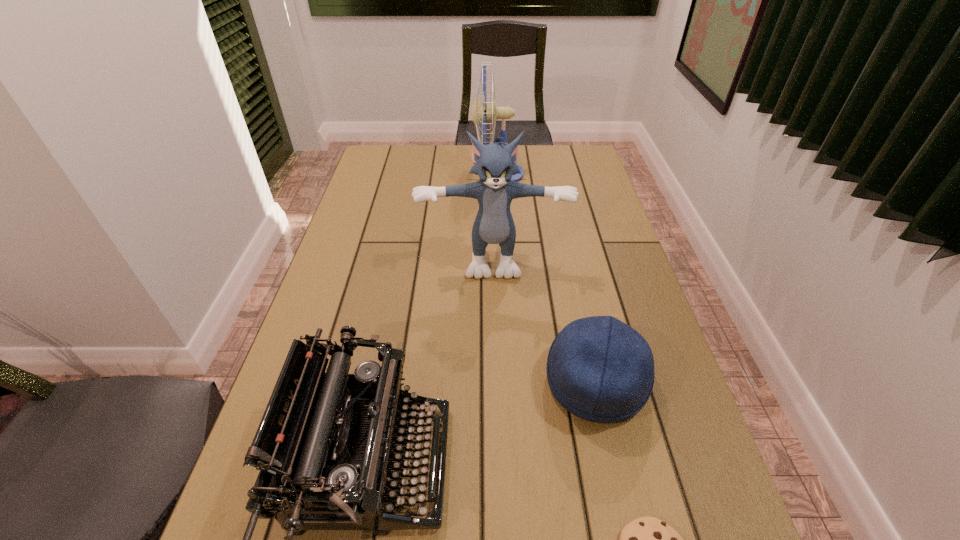
The width and height of the screenshot is (960, 540). Identify the location of blank space at the far edge of the desktop. (445, 154).

Locate an element on the screen. The image size is (960, 540). free point at the left edge is located at coordinates (397, 182).

In the image, there is a desktop. Identify the location of vacant space at the right edge. This screenshot has width=960, height=540. (588, 251).

This screenshot has height=540, width=960. I want to click on free space at the far left corner, so click(x=371, y=172).

This screenshot has height=540, width=960. I want to click on vacant space at the far right corner of the desktop, so click(x=586, y=172).

Point out which object is positioned as the second nearest to the second shortest object. Please provide its 2D coordinates. Your answer should be formatted as a tuple, i.e. [(x, y)], where the tuple contains the x and y coordinates of a point satisfying the conditions above.

[(313, 417)]

Find the location of a particular element. the fourth closest object relative to the third tallest object is located at coordinates (492, 112).

Locate an element on the screen. This screenshot has width=960, height=540. vacant space that satisfies the following two spatial constraints: 1. at the front of the farthest object where the blades are visible; 2. on the front-facing side of the second farthest object is located at coordinates (503, 256).

Identify the location of free spot that satisfies the following two spatial constraints: 1. on the front-facing side of the fourth nearest object; 2. on the right side of the skullcap. (496, 383).

You are a GUI agent. You are given a task and a screenshot of the screen. Output one action in this format:
    pyautogui.click(x=<x>, y=<y>)
    Task: Click on the free location that satisfies the following two spatial constraints: 1. at the front of the farthest object where the blades are visible; 2. on the back side of the second shortest object
    
    Given the screenshot: What is the action you would take?
    pyautogui.click(x=511, y=383)